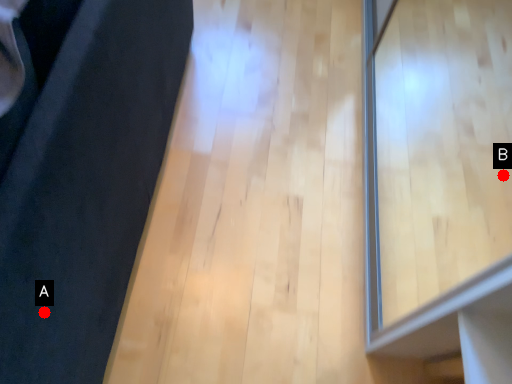
Question: Two points are circled on the image, labeled by A and B beside each circle. Which point is farther to the camera?

Choices:
 (A) A is further
 (B) B is further

Answer: (B)